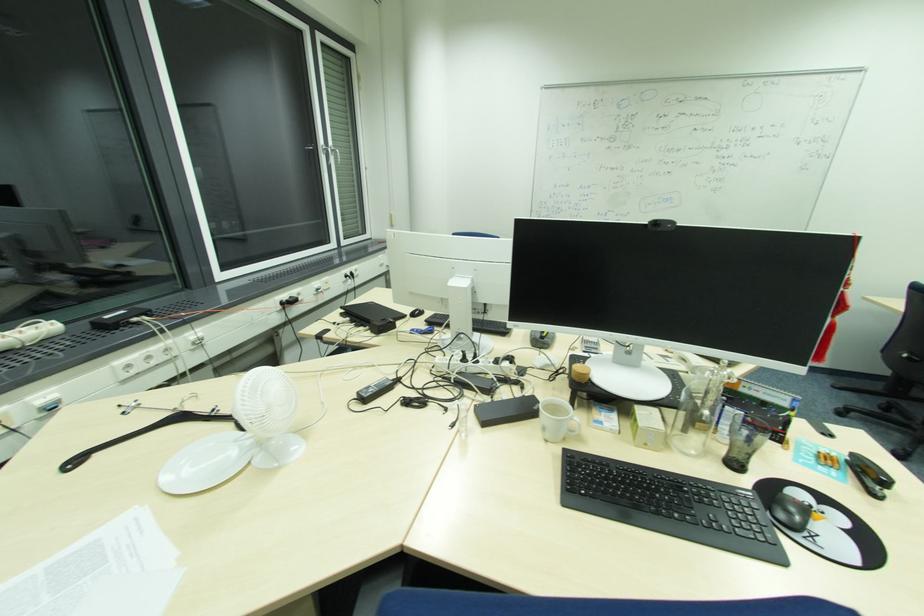
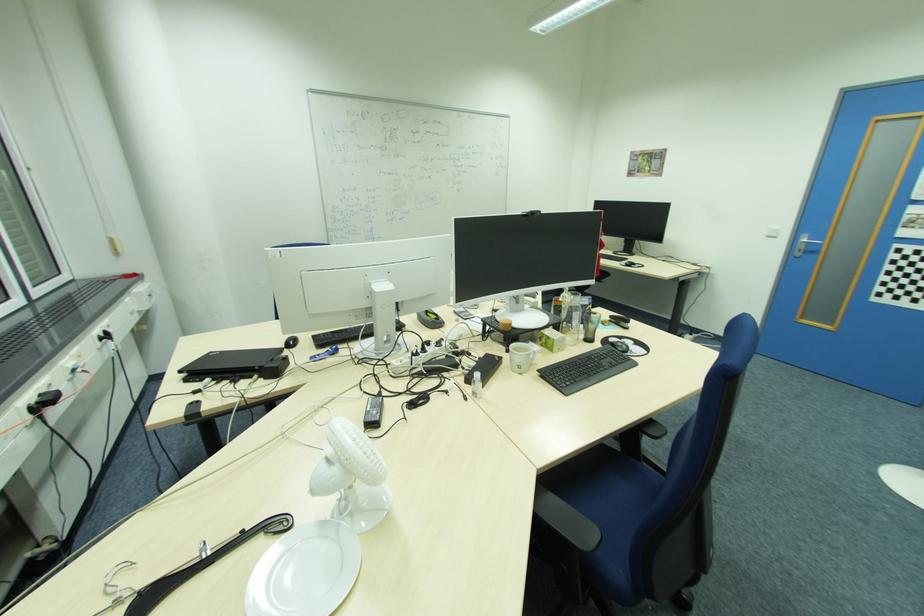
The point at (736, 464) is marked in the first image. Where is the corresponding point in the second image?

(591, 339)